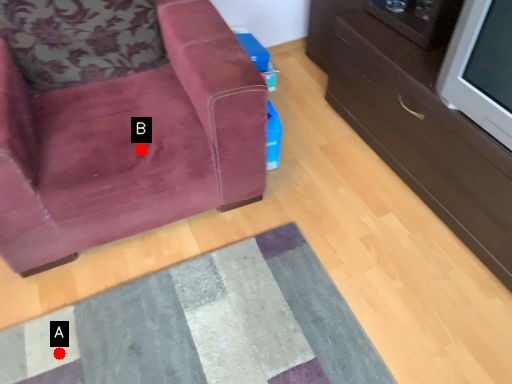
Question: Two points are circled on the image, labeled by A and B beside each circle. Which of the following is the farthest from the observer?

Choices:
 (A) A is further
 (B) B is further

Answer: (B)